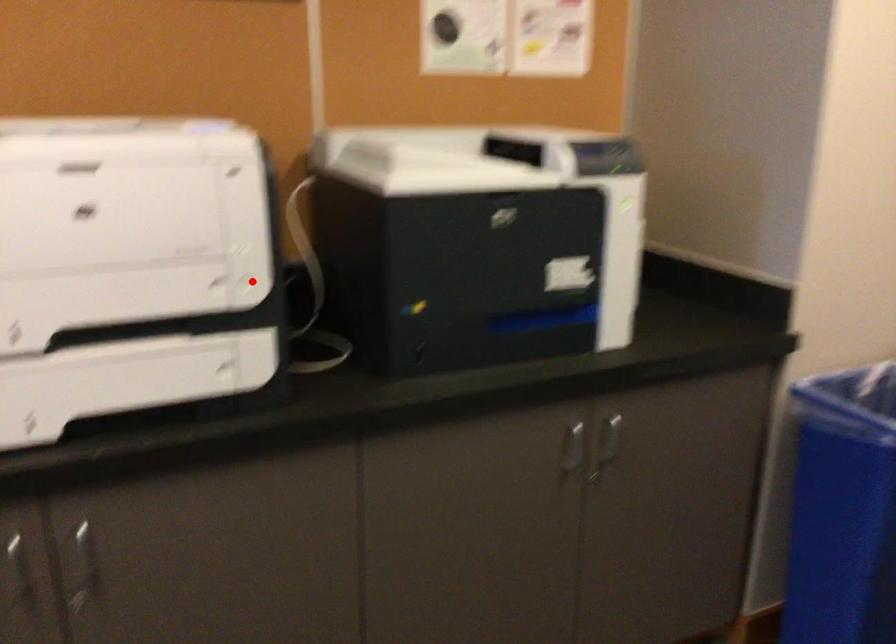
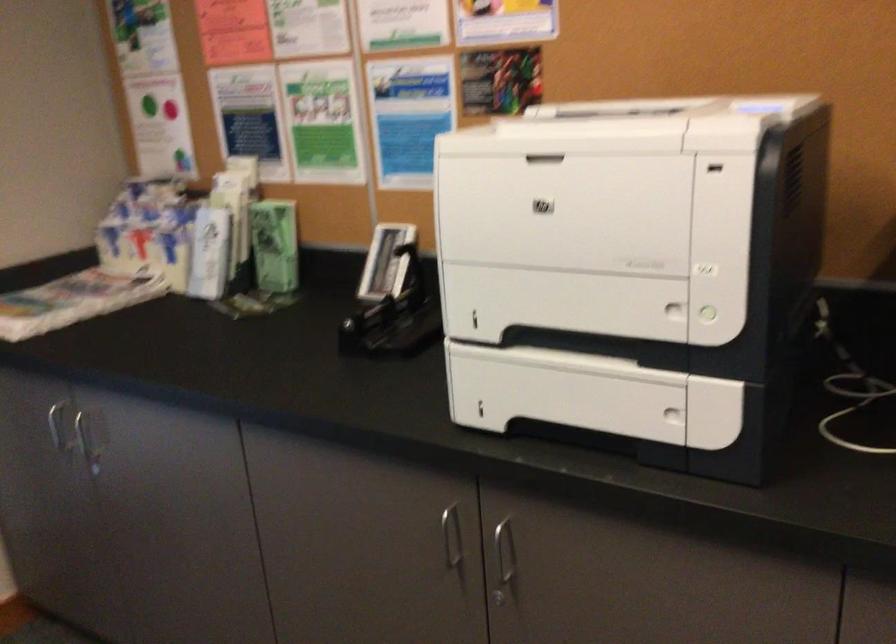
Question: A red point is marked in image1. In image2, is the corresponding 3D point closer to the camera or farther? Reply with the corresponding letter.

Choices:
 (A) The corresponding 3D point is closer.
 (B) The corresponding 3D point is farther.

Answer: (A)